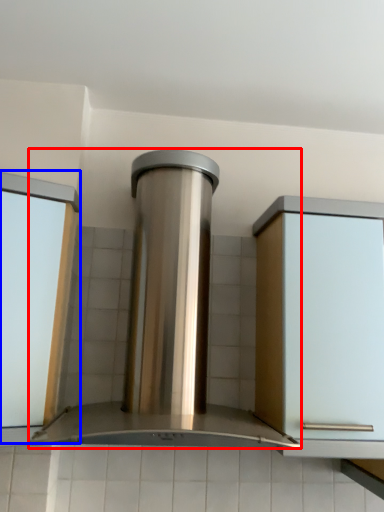
Question: Which point is further to the camera, home appliance (highlighted by a red box) or window frame (highlighted by a blue box)?

Choices:
 (A) home appliance
 (B) window frame

Answer: (B)